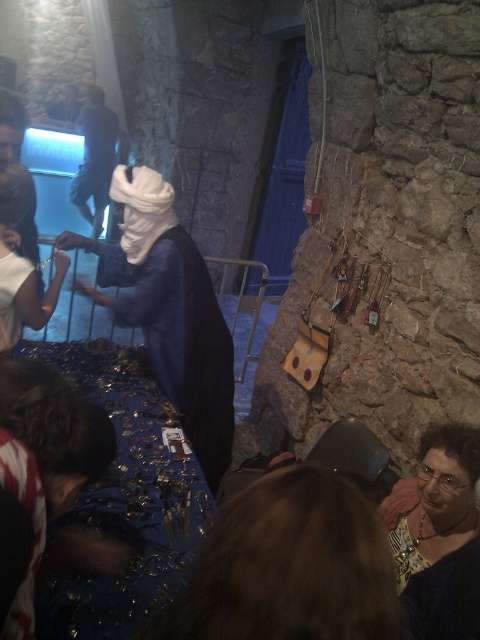
Is matte blue dress at center above dark blue fabric at center?

Actually, matte blue dress at center is below dark blue fabric at center.

Can you confirm if matte blue dress at center is shorter than dark blue fabric at center?

Yes, matte blue dress at center is shorter than dark blue fabric at center.

Does point (159, 372) lie behind point (115, 156)?

No, it is not.

Where is `matte blue dress at center`? matte blue dress at center is located at coordinates (168, 310).

Does point (178, 353) come behind point (436, 496)?

Yes, point (178, 353) is farther from viewer.

Between matte blue dress at center and matte gold necklace at lower right, which one appears on the left side from the viewer's perspective?

Positioned to the left is matte blue dress at center.

Measure the distance between matte blue dress at center and camera.

A distance of 2.30 meters exists between matte blue dress at center and camera.

This screenshot has width=480, height=640. Find the location of `matte blue dress at center`. matte blue dress at center is located at coordinates (168, 310).

Can you confirm if matte gold necklace at lower right is wider than dark blue fabric at center?

No, matte gold necklace at lower right is not wider than dark blue fabric at center.

Which of these two, matte gold necklace at lower right or dark blue fabric at center, stands shorter?

Standing shorter between the two is matte gold necklace at lower right.

Is point (415, 476) closer to camera compared to point (97, 196)?

Yes, it is.

Where is `matte gold necklace at lower right`? The image size is (480, 640). matte gold necklace at lower right is located at coordinates (433, 499).